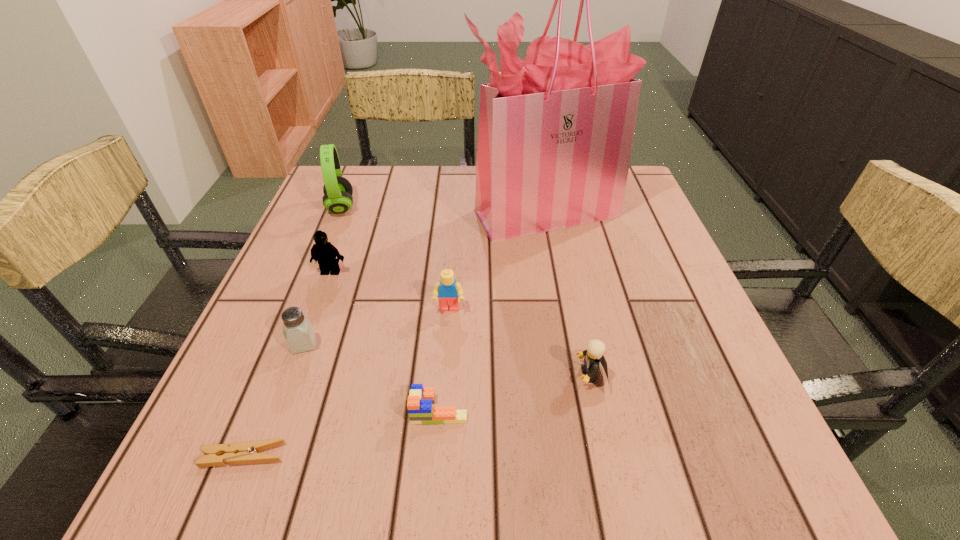
Locate an element on the screen. The width and height of the screenshot is (960, 540). vacant space situated on the left of the tallest object is located at coordinates (363, 213).

Identify the location of free space located on the front of the second tallest object. (324, 251).

This screenshot has width=960, height=540. Identify the location of vacant space located on the face of the leftmost Lego. (307, 337).

Find the location of `vacant position located 0.240m on the front-facing side of the fourth farthest object`. vacant position located 0.240m on the front-facing side of the fourth farthest object is located at coordinates pos(441,428).

Identify the location of free location located on the front-facing side of the rightmost Lego. (525, 375).

At what (x,y) coordinates should I click in order to perform the action: click on free location located on the front-facing side of the rightmost Lego. Please return your answer as a coordinate pair (x, y). This screenshot has width=960, height=540. Looking at the image, I should click on (537, 375).

This screenshot has height=540, width=960. In order to click on vacant region located 0.190m on the front-facing side of the rightmost Lego in this screenshot , I will do `click(468, 375)`.

You are a GUI agent. You are given a task and a screenshot of the screen. Output one action in this format:
    pyautogui.click(x=<x>, y=<y>)
    Task: Click on the free space located 0.120m on the right of the saltshaker
    The width and height of the screenshot is (960, 540).
    Given the screenshot: What is the action you would take?
    pyautogui.click(x=382, y=344)

Where is `free space located on the front of the shortest Lego`? This screenshot has height=540, width=960. free space located on the front of the shortest Lego is located at coordinates (435, 468).

This screenshot has width=960, height=540. In order to click on vacant space located on the back of the nearest object in this screenshot , I will do click(271, 387).